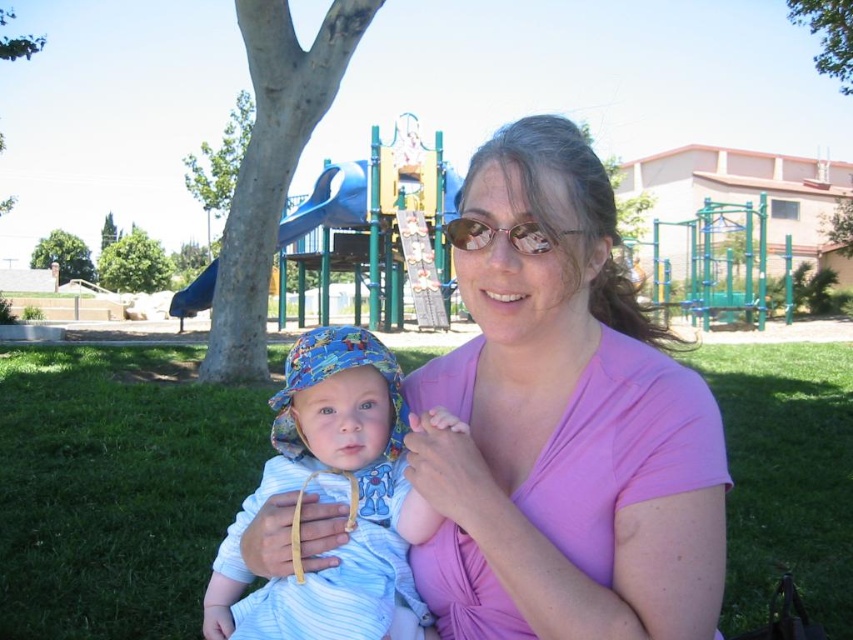
You are a photographer trying to capture a closeup of the baby in the image. You need to ensure that both the green grass at lower center and the glossy plastic goggles at center are visible in the shot. Which object should you focus on to make sure both are in frame?

Since the green grass at lower center is wider than the glossy plastic goggles at center, you should focus on the green grass at lower center to ensure both objects are in frame.

Looking at this image, you are a photographer trying to capture the baby in the light blue outfit with the blue cotton hat at center. The camera has a focus point at point (331, 500). Will the focus point land on the blue cotton hat at center?

The blue cotton hat at center is located at point (331, 500), so yes, the focus point will land on the blue cotton hat at center.